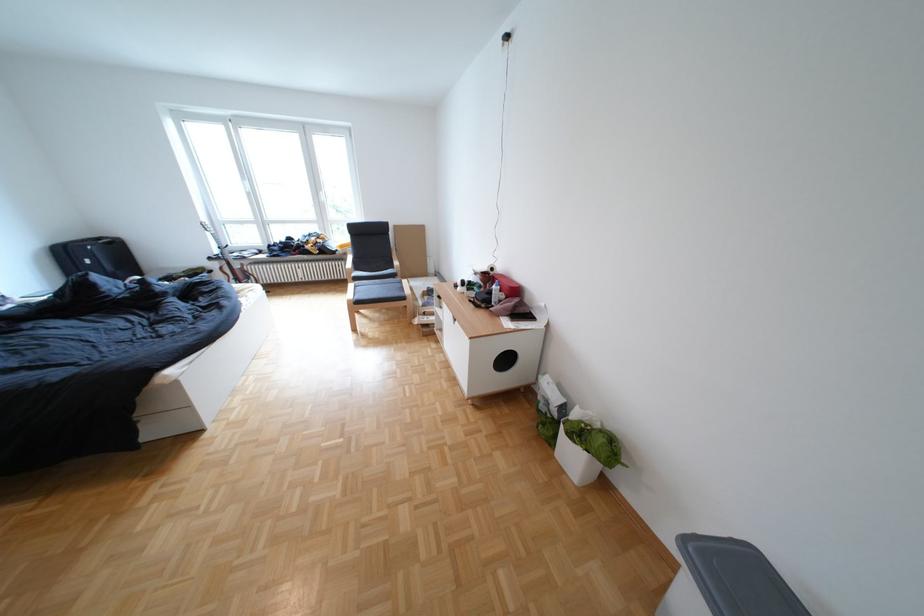
Where would you resting arm the chair armrest? Please return your answer as a coordinate pair (x, y).

(345, 267)